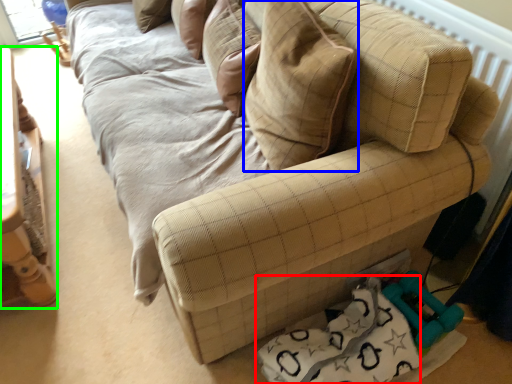
Question: Which is farther away from material (highlighted by a red box)? throw pillow (highlighted by a blue box) or furniture (highlighted by a green box)?

Choices:
 (A) throw pillow
 (B) furniture

Answer: (B)